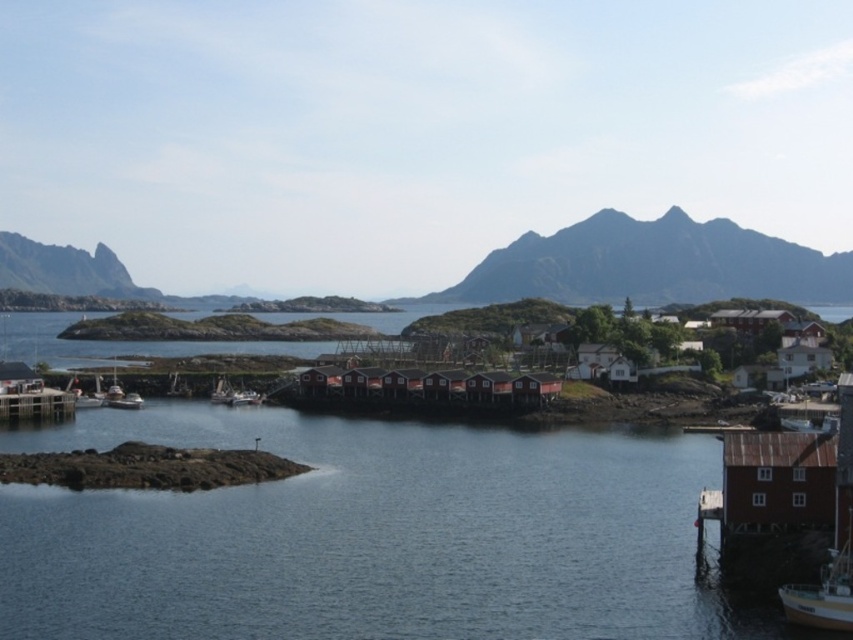
You are a tourist visiting this coastal village and want to take a boat tour. You see the wooden boat at lower right and the wooden dock at lower left. Which one is closer to you?

The wooden boat at lower right is smaller than the wooden dock at lower left, so it is closer to you.

You are a visitor standing at the center of the coastal village, looking towards the water. You see the wooden boat at lower right. Can you estimate its exact coordinates in the image?

The wooden boat at lower right is located at coordinates point (825, 589).

You are standing on the red wooden dock at center and want to reach the metallic silver boat at lower left. The boat requires a crew member to board it within 10 meters to operate the boarding ramp. Can you board the boat directly from your current position?

The red wooden dock at center is 27.79 meters away from the metallic silver boat at lower left. Since the required distance for boarding is within 10 meters, you cannot board the boat directly from your current position as the distance is too far.